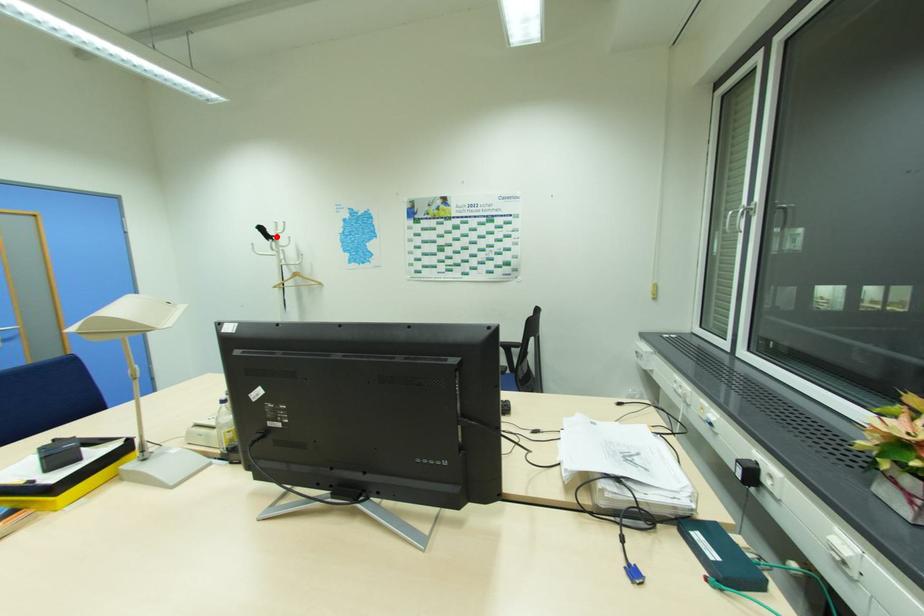
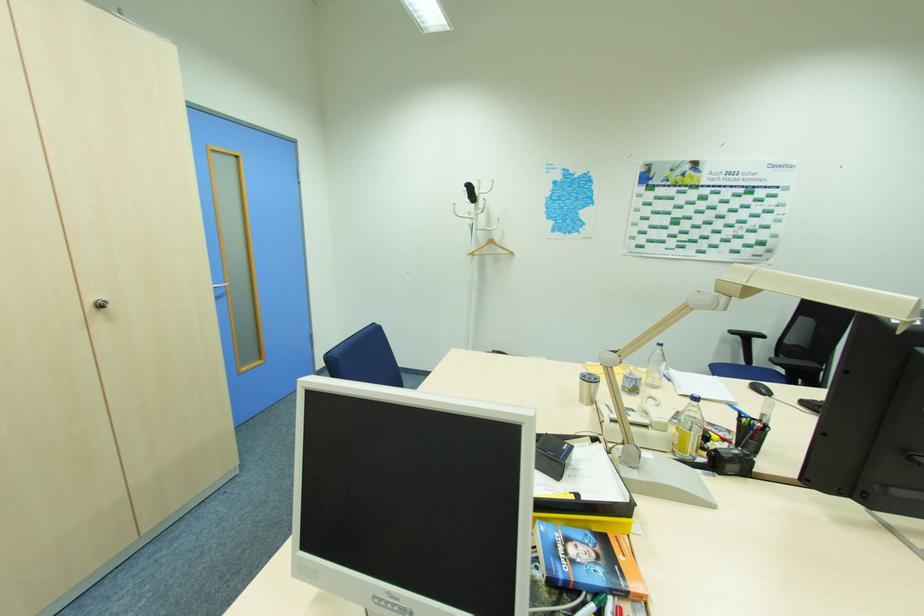
The point at the highlighted location is marked in the first image. Where is the corresponding point in the second image?

(479, 197)